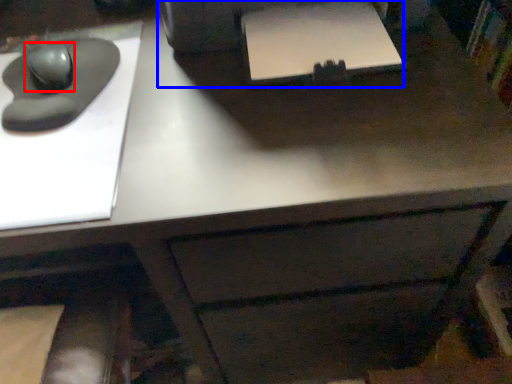
Question: Which object appears closest to the camera in this image, mouse (highlighted by a red box) or printer (highlighted by a blue box)?

Choices:
 (A) mouse
 (B) printer

Answer: (B)